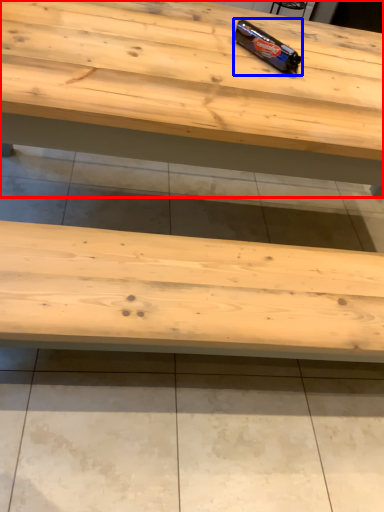
Question: Among these objects, which one is nearest to the camera, table (highlighted by a red box) or chocolate bar (highlighted by a blue box)?

Choices:
 (A) table
 (B) chocolate bar

Answer: (A)